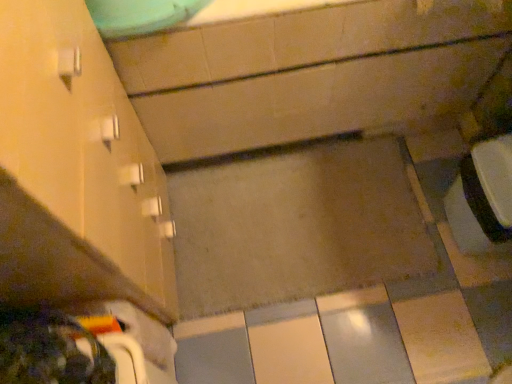
Question: Do you think matte ceramic bathtub at center is within matte white cabinet at left, or outside of it?

Choices:
 (A) outside
 (B) inside

Answer: (A)

Question: From a real-world perspective, relative to matte white cabinet at left, is matte ceramic bathtub at center vertically above or below?

Choices:
 (A) below
 (B) above

Answer: (A)

Question: Is matte ceramic bathtub at center bigger or smaller than matte white cabinet at left?

Choices:
 (A) small
 (B) big

Answer: (B)

Question: Based on their positions, is matte white cabinet at left located to the left or right of matte ceramic bathtub at center?

Choices:
 (A) left
 (B) right

Answer: (A)

Question: From their relative heights in the image, would you say matte white cabinet at left is taller or shorter than matte ceramic bathtub at center?

Choices:
 (A) tall
 (B) short

Answer: (A)

Question: From a real-world perspective, is matte white cabinet at left positioned above or below matte ceramic bathtub at center?

Choices:
 (A) below
 (B) above

Answer: (B)

Question: Is matte white cabinet at left spatially inside matte ceramic bathtub at center, or outside of it?

Choices:
 (A) outside
 (B) inside

Answer: (A)